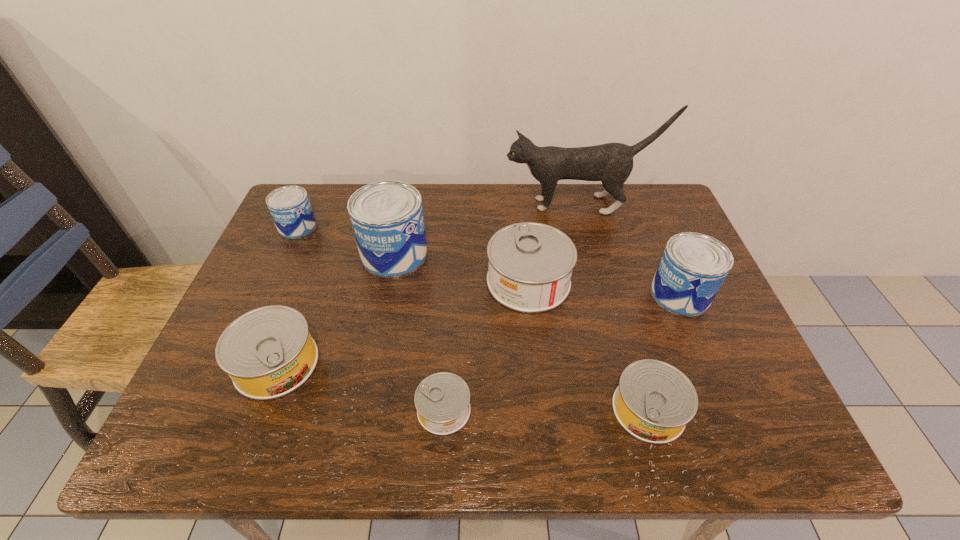
Where is `vacant space that's between the cat and the second shortest can`? This screenshot has width=960, height=540. vacant space that's between the cat and the second shortest can is located at coordinates (613, 307).

Locate an element on the screen. empty location between the farthest silver can and the third smallest silver can is located at coordinates pos(402,322).

Identify which object is the nearest to the fifth object from right to left. Please provide its 2D coordinates. Your answer should be formatted as a tuple, i.e. [(x, y)], where the tuple contains the x and y coordinates of a point satisfying the conditions above.

[(530, 266)]

Select which object is the closest to the second smallest blue can. Please provide its 2D coordinates. Your answer should be formatted as a tuple, i.e. [(x, y)], where the tuple contains the x and y coordinates of a point satisfying the conditions above.

[(654, 401)]

This screenshot has width=960, height=540. In order to click on can that stands as the second closest to the biggest silver can in this screenshot , I will do 654,401.

Identify which can is located as the nearest to the leftmost blue can. Please provide its 2D coordinates. Your answer should be formatted as a tuple, i.e. [(x, y)], where the tuple contains the x and y coordinates of a point satisfying the conditions above.

[(387, 219)]

Identify which blue can is the second nearest to the third can from right to left. Please provide its 2D coordinates. Your answer should be formatted as a tuple, i.e. [(x, y)], where the tuple contains the x and y coordinates of a point satisfying the conditions above.

[(693, 267)]

Identify the location of the closest blue can to the leftmost blue can. pyautogui.click(x=387, y=219).

The width and height of the screenshot is (960, 540). I want to click on silver can that is the second closest to the second smallest blue can, so click(530, 266).

Find the location of a particular element. The height and width of the screenshot is (540, 960). silver can object that ranks as the closest to the biggest silver can is located at coordinates (654, 401).